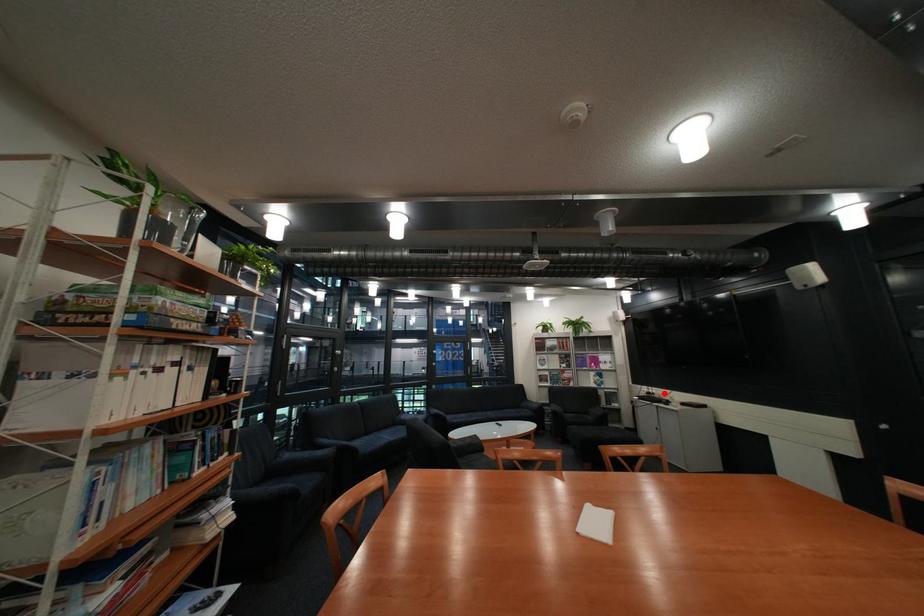
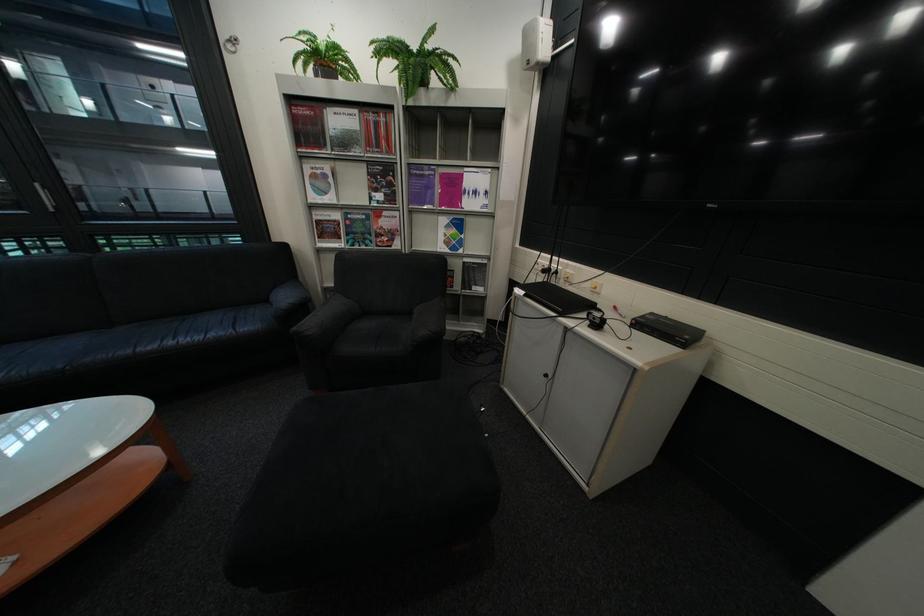
Find the pixel in the second image that matches the highlighted location in the first image.

(563, 270)